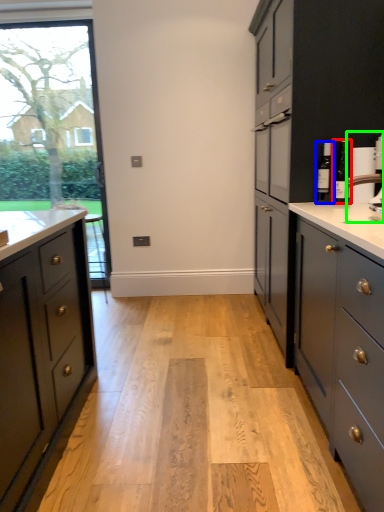
Question: Considering the real-world distances, which object is farthest from bottle (highlighted by a red box)? bottle (highlighted by a blue box) or coffee machine (highlighted by a green box)?

Choices:
 (A) bottle
 (B) coffee machine

Answer: (B)